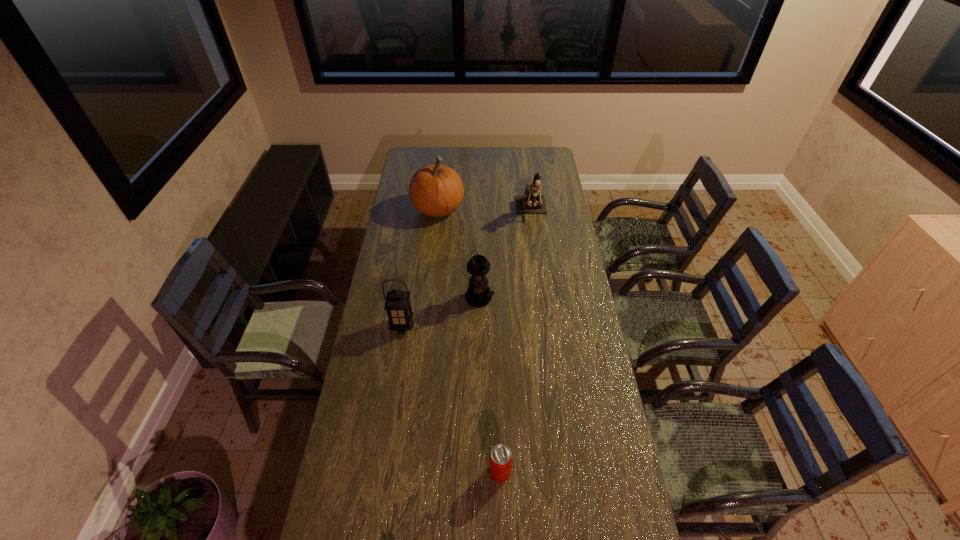
The width and height of the screenshot is (960, 540). Identify the location of figurine. (530, 203).

Where is `pumpkin`? This screenshot has height=540, width=960. pumpkin is located at coordinates (436, 190).

Identify the location of the second nearest object. (397, 304).

This screenshot has height=540, width=960. I want to click on the nearer lantern, so click(397, 304).

This screenshot has width=960, height=540. I want to click on the farther lantern, so click(478, 294).

This screenshot has width=960, height=540. I want to click on the third farthest object, so click(478, 294).

You are a GUI agent. You are given a task and a screenshot of the screen. Output one action in this format:
    pyautogui.click(x=<x>, y=<y>)
    Task: Click on the shortest object
    
    Given the screenshot: What is the action you would take?
    pyautogui.click(x=500, y=458)

The width and height of the screenshot is (960, 540). What are the coordinates of `can` in the screenshot? It's located at (500, 458).

Identify the location of free space located 0.350m on the front-facing side of the rightmost object. The image size is (960, 540). (540, 275).

This screenshot has height=540, width=960. I want to click on free spot located on the stem of the pumpkin, so 478,209.